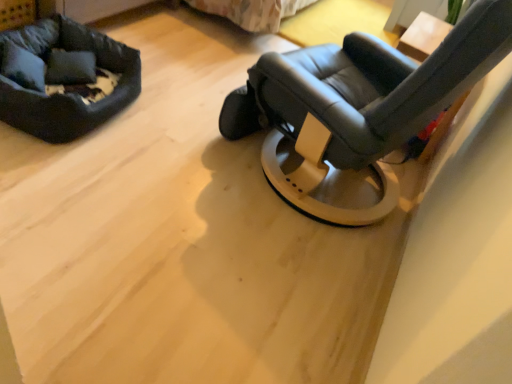
What do you see at coordinates (423, 36) in the screenshot? The height and width of the screenshot is (384, 512). I see `wooden table at upper right` at bounding box center [423, 36].

The height and width of the screenshot is (384, 512). Describe the element at coordinates (70, 67) in the screenshot. I see `soft gray fabric pillow at upper left` at that location.

The width and height of the screenshot is (512, 384). In order to click on soft gray fabric pillow at upper left in this screenshot , I will do tap(70, 67).

The width and height of the screenshot is (512, 384). I want to click on wooden table at upper right, so click(423, 36).

From the image's perspective, which object appears higher, soft black fabric dog bed at upper left or soft gray fabric pillow at upper left?

soft gray fabric pillow at upper left is shown above in the image.

Which of these two, soft black fabric dog bed at upper left or soft gray fabric pillow at upper left, is thinner?

With smaller width is soft gray fabric pillow at upper left.

Considering the sizes of objects soft black fabric dog bed at upper left and soft gray fabric pillow at upper left in the image provided, who is taller, soft black fabric dog bed at upper left or soft gray fabric pillow at upper left?

soft black fabric dog bed at upper left is taller.

Based on the photo, from a real-world perspective, is soft black fabric dog bed at upper left above or below soft gray fabric pillow at upper left?

soft black fabric dog bed at upper left is above soft gray fabric pillow at upper left.

From the image's perspective, is soft gray fabric pillow at upper left under matte black chair at center?

Incorrect, from the image's perspective, soft gray fabric pillow at upper left is higher than matte black chair at center.

Is soft gray fabric pillow at upper left far away from matte black chair at center?

No.

The width and height of the screenshot is (512, 384). In order to click on pillow directly beneath the matte black chair at center (from a real-world perspective) in this screenshot , I will do `click(70, 67)`.

Is soft gray fabric pillow at upper left at the left side of matte black chair at center?

Correct, you'll find soft gray fabric pillow at upper left to the left of matte black chair at center.

Who is shorter, matte black chair at center or soft gray fabric pillow at upper left?

soft gray fabric pillow at upper left is shorter.

Between matte black chair at center and soft gray fabric pillow at upper left, which one appears on the left side from the viewer's perspective?

soft gray fabric pillow at upper left.

The width and height of the screenshot is (512, 384). There is a soft gray fabric pillow at upper left. Find the location of `chair above it (from a real-world perspective)`. chair above it (from a real-world perspective) is located at coordinates (358, 110).

This screenshot has width=512, height=384. Identify the location of dog bed below the wooden table at upper right (from the image's perspective). (69, 96).

From the image's perspective, is soft black fabric dog bed at upper left below wooden table at upper right?

Yes, from the image's perspective, soft black fabric dog bed at upper left is below wooden table at upper right.

Is soft black fabric dog bed at upper left facing away from wooden table at upper right?

soft black fabric dog bed at upper left does not have its back to wooden table at upper right.

Between soft black fabric dog bed at upper left and wooden table at upper right, which one appears on the right side from the viewer's perspective?

Positioned to the right is wooden table at upper right.

Considering the points (340, 97) and (424, 29), which point is in front, point (340, 97) or point (424, 29)?

Positioned in front is point (340, 97).

Looking at the image, does matte black chair at center seem bigger or smaller compared to wooden table at upper right?

matte black chair at center is bigger than wooden table at upper right.

In order to click on table that appears on the right of matte black chair at center in this screenshot , I will do `click(423, 36)`.

Are matte black chair at center and wooden table at upper right far apart?

No.

Considering the relative sizes of matte black chair at center and soft black fabric dog bed at upper left in the image provided, is matte black chair at center bigger than soft black fabric dog bed at upper left?

Yes, matte black chair at center is bigger than soft black fabric dog bed at upper left.

How different are the orientations of matte black chair at center and soft black fabric dog bed at upper left in degrees?

The angle between the facing direction of matte black chair at center and the facing direction of soft black fabric dog bed at upper left is 159 degrees.

Which is correct: matte black chair at center is inside soft black fabric dog bed at upper left, or outside of it?

matte black chair at center lies outside soft black fabric dog bed at upper left.

From the image's perspective, which object appears higher, matte black chair at center or soft black fabric dog bed at upper left?

soft black fabric dog bed at upper left appears higher in the image.

Looking at this image, is soft black fabric dog bed at upper left located within soft gray fabric pillow at upper left?

No, soft gray fabric pillow at upper left does not contain soft black fabric dog bed at upper left.

Considering the points (90, 55) and (111, 115), which point is behind, point (90, 55) or point (111, 115)?

The point (90, 55) is behind.

Does soft gray fabric pillow at upper left come behind soft black fabric dog bed at upper left?

Yes.

Identify the location of dog bed that appears below the soft gray fabric pillow at upper left (from the image's perspective). Image resolution: width=512 pixels, height=384 pixels. (69, 96).

At what (x,y) coordinates should I click in order to perform the action: click on dog bed above the soft gray fabric pillow at upper left (from a real-world perspective). Please return your answer as a coordinate pair (x, y). The height and width of the screenshot is (384, 512). Looking at the image, I should click on (69, 96).

Find the location of a particular element. This screenshot has width=512, height=384. pillow that appears on the left of matte black chair at center is located at coordinates click(x=70, y=67).

Looking at the image, which one is located further to soft black fabric dog bed at upper left, soft gray fabric pillow at upper left or matte black chair at center?

The object further to soft black fabric dog bed at upper left is matte black chair at center.

Which object lies nearer to the anchor point wooden table at upper right, matte black chair at center or soft gray fabric pillow at upper left?

The object closer to wooden table at upper right is matte black chair at center.

From the image, which object appears to be farther from soft gray fabric pillow at upper left, matte black chair at center or soft black fabric dog bed at upper left?

The object further to soft gray fabric pillow at upper left is matte black chair at center.

When comparing their distances from soft gray fabric pillow at upper left, does wooden table at upper right or soft black fabric dog bed at upper left seem further?

wooden table at upper right is positioned further to the anchor soft gray fabric pillow at upper left.

From the image, which object appears to be farther from soft gray fabric pillow at upper left, soft black fabric dog bed at upper left or wooden table at upper right?

Based on the image, wooden table at upper right appears to be further to soft gray fabric pillow at upper left.

Which object lies further to the anchor point soft black fabric dog bed at upper left, wooden table at upper right or soft gray fabric pillow at upper left?

Based on the image, wooden table at upper right appears to be further to soft black fabric dog bed at upper left.

From the picture: Considering their positions, is soft black fabric dog bed at upper left positioned closer to matte black chair at center than soft gray fabric pillow at upper left?

The object closer to matte black chair at center is soft black fabric dog bed at upper left.

Looking at the image, which one is located further to soft black fabric dog bed at upper left, soft gray fabric pillow at upper left or wooden table at upper right?

wooden table at upper right is positioned further to the anchor soft black fabric dog bed at upper left.

Find the location of `pillow located between matte black chair at center and wooden table at upper right in the depth direction`. pillow located between matte black chair at center and wooden table at upper right in the depth direction is located at coordinates (70, 67).

The width and height of the screenshot is (512, 384). Identify the location of pillow situated between soft black fabric dog bed at upper left and matte black chair at center from left to right. (70, 67).

The height and width of the screenshot is (384, 512). In order to click on pillow located between soft black fabric dog bed at upper left and wooden table at upper right in the left-right direction in this screenshot , I will do `click(70, 67)`.

At what (x,y) coordinates should I click in order to perform the action: click on dog bed between matte black chair at center and wooden table at upper right along the z-axis. Please return your answer as a coordinate pair (x, y). Image resolution: width=512 pixels, height=384 pixels. Looking at the image, I should click on (69, 96).